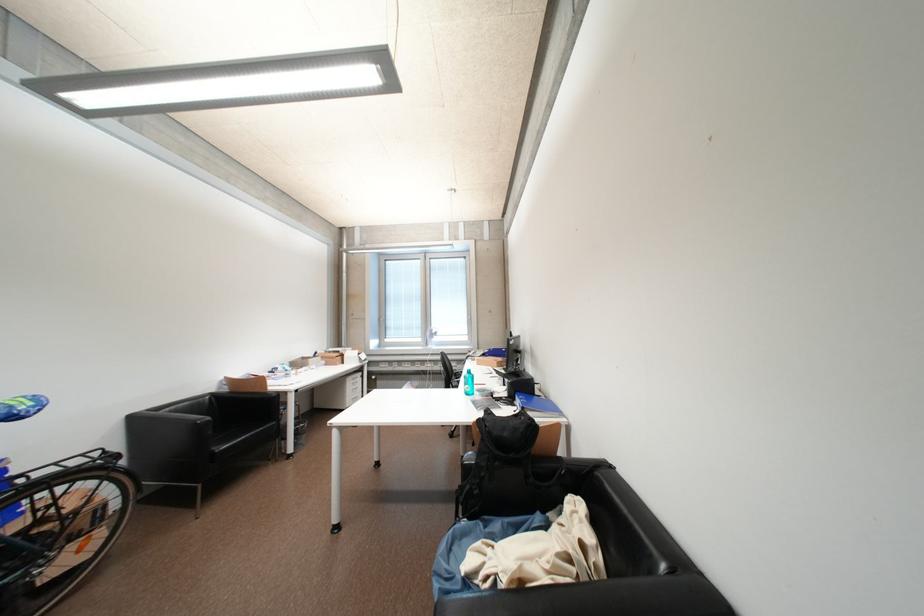
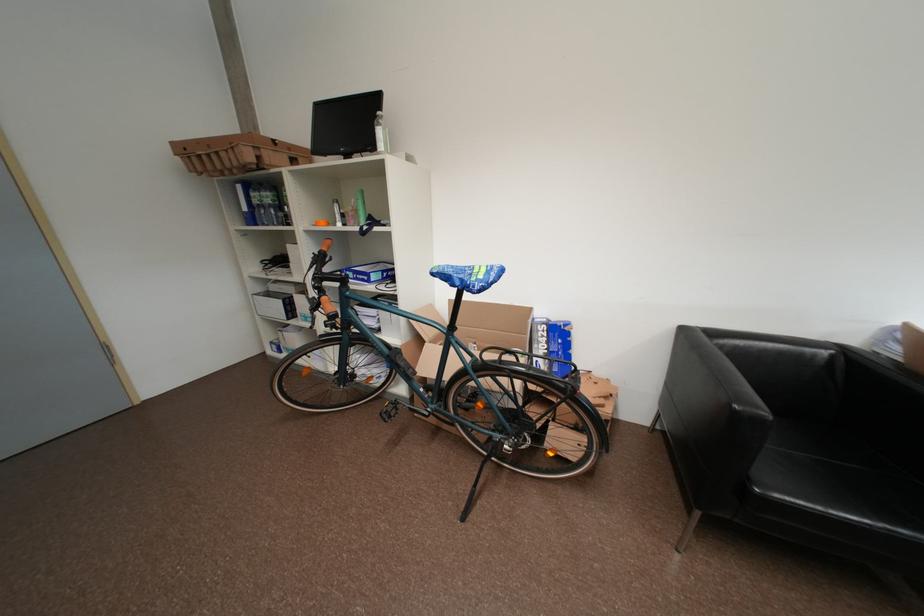
Where in the second image is the point corresponding to (x=127, y=459) from the first image?

(582, 391)